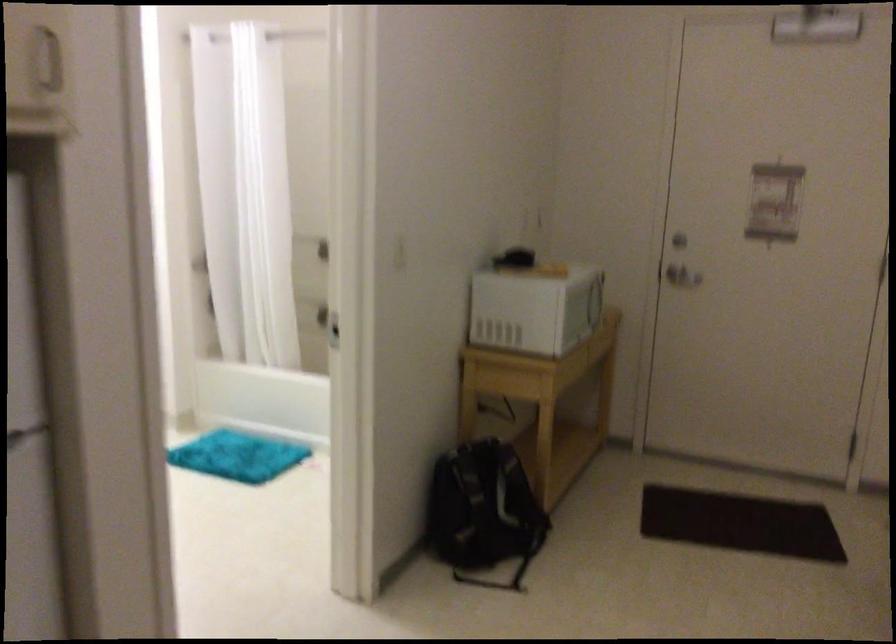
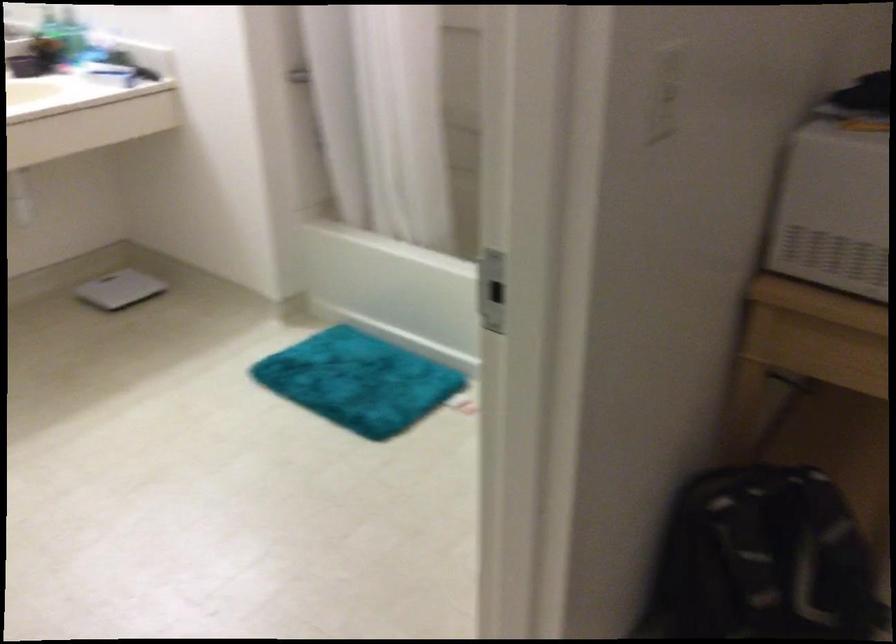
Where in the second image is the point corresponding to (403,238) from the first image?

(666, 93)